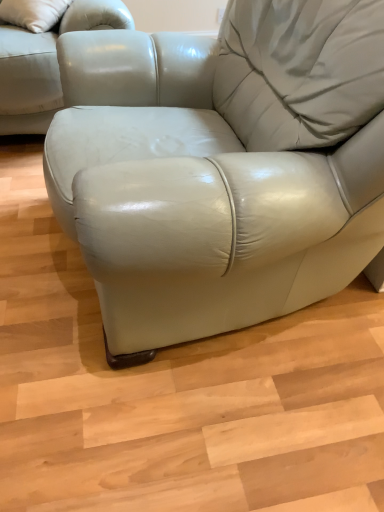
Consider the image. What is the approximate height of matte leather couch at upper left?

It is 13.07 inches.

Find the location of a particular element. The height and width of the screenshot is (512, 384). matte leather couch at upper left is located at coordinates (45, 64).

What is the approximate width of matte leather couch at upper left?

matte leather couch at upper left is 13.14 inches in width.

Describe the element at coordinates (45, 64) in the screenshot. I see `matte leather couch at upper left` at that location.

What do you see at coordinates (228, 173) in the screenshot?
I see `matte leather armchair at center` at bounding box center [228, 173].

At what (x,y) coordinates should I click in order to perform the action: click on matte leather armchair at center. Please return your answer as a coordinate pair (x, y). Looking at the image, I should click on (228, 173).

Identify the location of matte leather couch at upper left. (45, 64).

Does matte leather couch at upper left appear on the left side of matte leather armchair at center?

Yes.

Is matte leather couch at upper left positioned before matte leather armchair at center?

No, matte leather couch at upper left is behind matte leather armchair at center.

Is point (10, 97) farther from viewer compared to point (140, 206)?

Yes, it is.

From the image's perspective, is matte leather couch at upper left on matte leather armchair at center?

Yes, from the image's perspective, matte leather couch at upper left is over matte leather armchair at center.

From a real-world perspective, which is physically above, matte leather couch at upper left or matte leather armchair at center?

matte leather couch at upper left, from a real-world perspective.

Between matte leather couch at upper left and matte leather armchair at center, which one has smaller width?

matte leather couch at upper left is thinner.

Which of these two, matte leather couch at upper left or matte leather armchair at center, stands shorter?

With less height is matte leather armchair at center.

Who is smaller, matte leather couch at upper left or matte leather armchair at center?

Smaller between the two is matte leather couch at upper left.

Would you say matte leather couch at upper left contains matte leather armchair at center?

Definitely not — matte leather armchair at center is not inside matte leather couch at upper left.

Would you consider matte leather couch at upper left to be distant from matte leather armchair at center?

Actually, matte leather couch at upper left and matte leather armchair at center are a little close together.

Is matte leather couch at upper left oriented towards matte leather armchair at center?

No, matte leather couch at upper left is not facing towards matte leather armchair at center.

What's the angular difference between matte leather couch at upper left and matte leather armchair at center's facing directions?

The facing directions of matte leather couch at upper left and matte leather armchair at center are 148 degrees apart.

Image resolution: width=384 pixels, height=512 pixels. What are the coordinates of `studio couch above the matte leather armchair at center (from a real-world perspective)` in the screenshot? It's located at (45, 64).

Which is more to the left, matte leather armchair at center or matte leather couch at upper left?

matte leather couch at upper left.

Considering the positions of objects matte leather armchair at center and matte leather couch at upper left in the image provided, who is in front, matte leather armchair at center or matte leather couch at upper left?

Positioned in front is matte leather armchair at center.

Does point (297, 59) come behind point (52, 37)?

No, it is not.

From the picture: From the image's perspective, is matte leather armchair at center beneath matte leather couch at upper left?

Yes, from the image's perspective, matte leather armchair at center is below matte leather couch at upper left.

From a real-world perspective, between matte leather armchair at center and matte leather couch at upper left, who is vertically lower?

matte leather armchair at center, from a real-world perspective.

Between matte leather armchair at center and matte leather couch at upper left, which one has larger width?

Wider between the two is matte leather armchair at center.

Is matte leather armchair at center shorter than matte leather couch at upper left?

Correct, matte leather armchair at center is not as tall as matte leather couch at upper left.

In terms of size, does matte leather armchair at center appear bigger or smaller than matte leather couch at upper left?

matte leather armchair at center is bigger than matte leather couch at upper left.

Is matte leather armchair at center inside or outside of matte leather couch at upper left?

matte leather armchair at center exists outside the volume of matte leather couch at upper left.

Is the surface of matte leather armchair at center in direct contact with matte leather couch at upper left?

matte leather armchair at center is not next to matte leather couch at upper left, and they're not touching.

Is matte leather armchair at center positioned with its back to matte leather couch at upper left?

That's not correct — matte leather armchair at center is not looking away from matte leather couch at upper left.

Can you tell me how much matte leather armchair at center and matte leather couch at upper left differ in facing direction?

148 degrees.

How far apart are matte leather armchair at center and matte leather couch at upper left?

matte leather armchair at center and matte leather couch at upper left are 27.17 inches apart from each other.

This screenshot has height=512, width=384. I want to click on table in front of the matte leather couch at upper left, so click(228, 173).

In order to click on studio couch that is behind the matte leather armchair at center in this screenshot , I will do `click(45, 64)`.

At what (x,y) coordinates should I click in order to perform the action: click on table on the right of the matte leather couch at upper left. Please return your answer as a coordinate pair (x, y). Looking at the image, I should click on (228, 173).